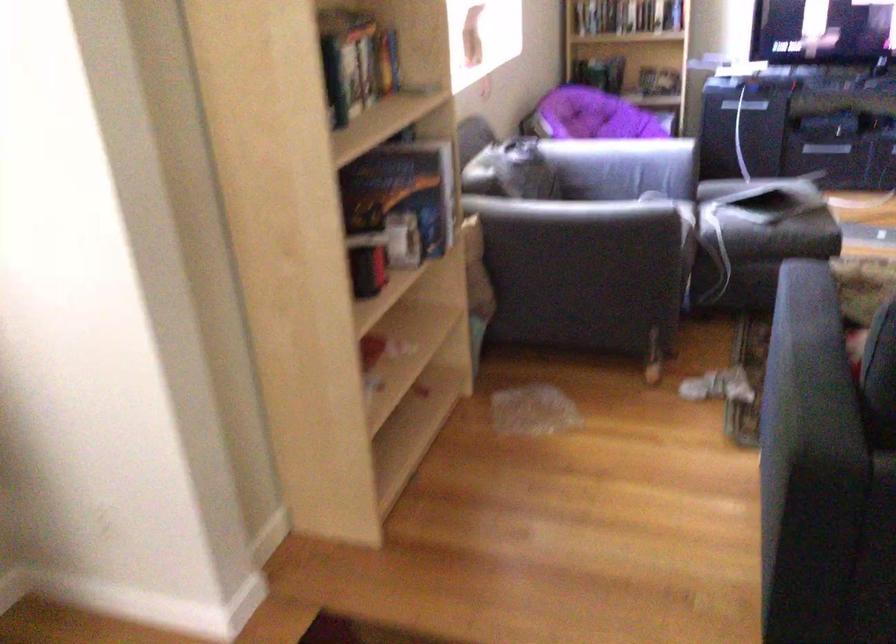
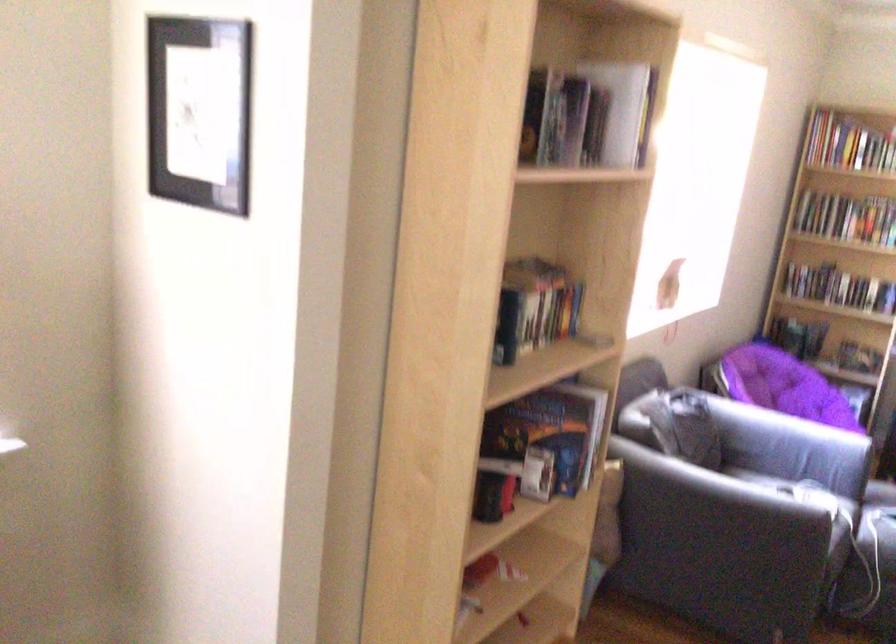
Question: How did the camera likely rotate?

Choices:
 (A) Left
 (B) Right
 (C) Up
 (D) Down

Answer: (A)